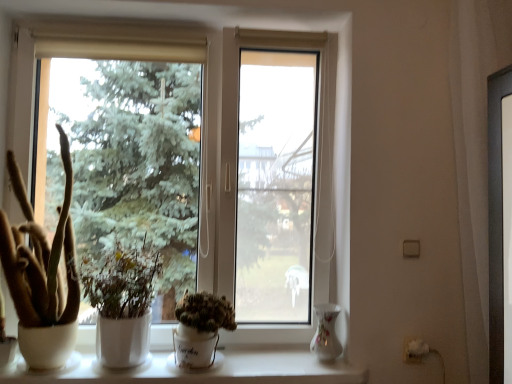
Where is `free point to the right of green matte cactus at center, which appears as the first houseplant when viewed from the right`? This screenshot has width=512, height=384. free point to the right of green matte cactus at center, which appears as the first houseplant when viewed from the right is located at coordinates coord(256,363).